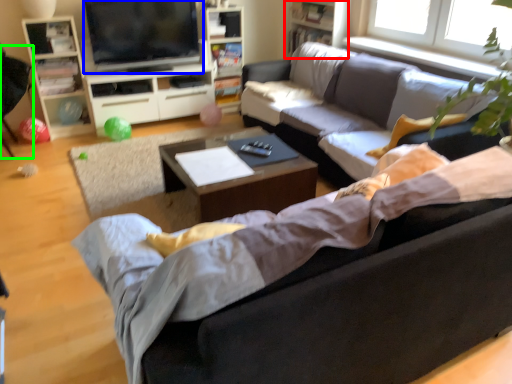
Question: Considering the real-world distances, which object is farthest from bookshelf (highlighted by a red box)? television (highlighted by a blue box) or armchair (highlighted by a green box)?

Choices:
 (A) television
 (B) armchair

Answer: (B)